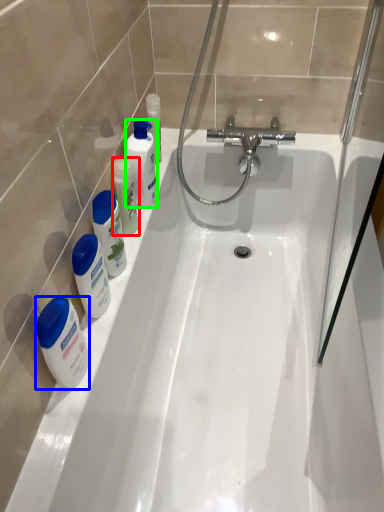
Question: Estimate the real-world distances between objects in this image. Which object is farther from mouthwash (highlighted by a red box), mouthwash (highlighted by a blue box) or cleaning product (highlighted by a green box)?

Choices:
 (A) mouthwash
 (B) cleaning product

Answer: (A)